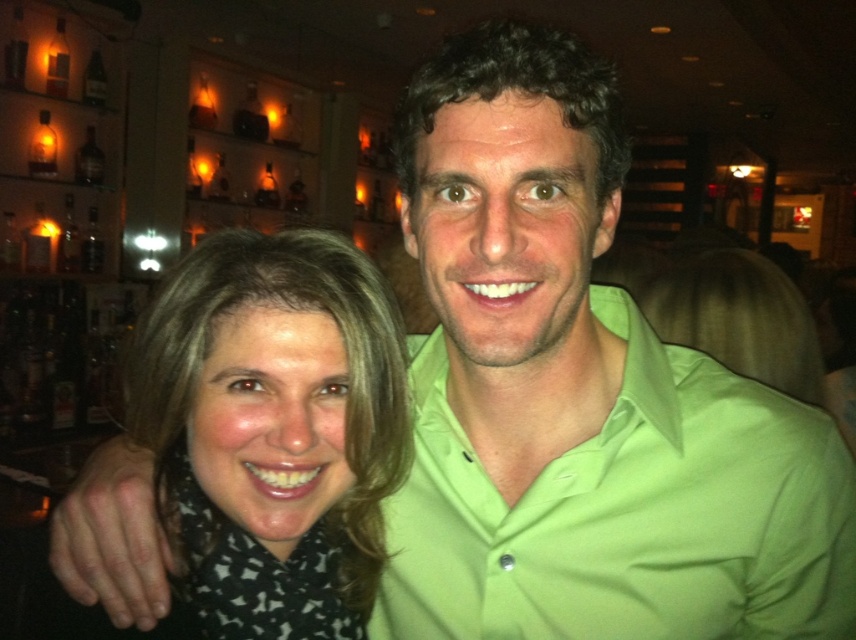
Does lime green polo shirt at center have a lesser width compared to matte black scarf at left?

In fact, lime green polo shirt at center might be wider than matte black scarf at left.

Who is positioned more to the right, lime green polo shirt at center or matte black scarf at left?

Positioned to the right is lime green polo shirt at center.

You are a GUI agent. You are given a task and a screenshot of the screen. Output one action in this format:
    pyautogui.click(x=<x>, y=<y>)
    Task: Click on the lime green polo shirt at center
    The height and width of the screenshot is (640, 856).
    Given the screenshot: What is the action you would take?
    pyautogui.click(x=627, y=513)

At what (x,y) coordinates should I click in order to perform the action: click on lime green polo shirt at center. Please return your answer as a coordinate pair (x, y). Looking at the image, I should click on (627, 513).